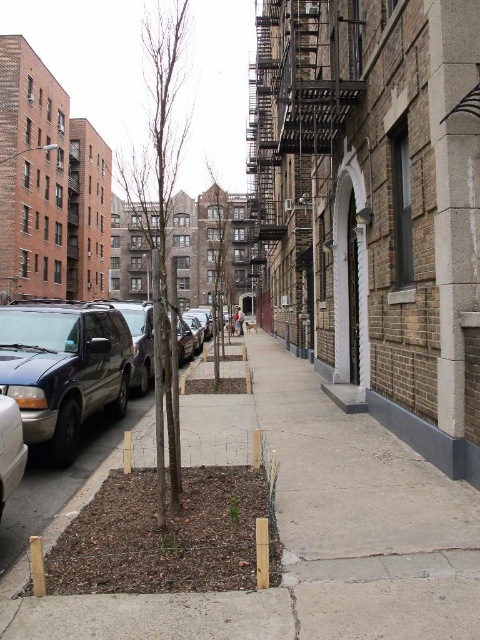
Question: Is matte black van at left behind green matte tree at center?

Choices:
 (A) yes
 (B) no

Answer: (B)

Question: Which object is the farthest from the matte black van at left?

Choices:
 (A) brown dirt at center
 (B) metallic blue van at left
 (C) bare wood tree at center

Answer: (C)

Question: Can you confirm if brown dirt at center is positioned to the left of green matte tree at center?

Choices:
 (A) yes
 (B) no

Answer: (B)

Question: Can you confirm if brown dirt at center is positioned below matte black van at left?

Choices:
 (A) yes
 (B) no

Answer: (A)

Question: Which object is closer to the camera taking this photo?

Choices:
 (A) brown dirt at center
 (B) metallic blue van at left

Answer: (A)

Question: Which point appears farthest from the camera in this image?

Choices:
 (A) (218, 241)
 (B) (173, 10)

Answer: (A)